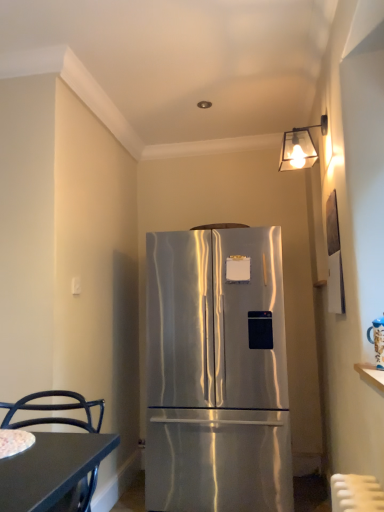
Describe the element at coordinates (300, 147) in the screenshot. Image resolution: width=384 pixels, height=512 pixels. I see `metallic glass lampshade at upper right` at that location.

Identify the location of black metal chair at lower left. Image resolution: width=384 pixels, height=512 pixels. (53, 409).

Do you think stainless steel refrigerator at center is within black metal chair at lower left, or outside of it?

stainless steel refrigerator at center is located beyond the bounds of black metal chair at lower left.

From a real-world perspective, which object stands above the other?

In real-world perspective, stainless steel refrigerator at center is above.

This screenshot has width=384, height=512. In order to click on refrigerator that is above the black metal chair at lower left (from a real-world perspective) in this screenshot , I will do [217, 372].

Does metallic glass lampshade at upper right contain stainless steel refrigerator at center?

No, stainless steel refrigerator at center is not inside metallic glass lampshade at upper right.

Is point (296, 157) positioned in front of point (222, 384)?

Yes, it is.

Is metallic glass lampshade at upper right to the right of stainless steel refrigerator at center from the viewer's perspective?

Yes, metallic glass lampshade at upper right is to the right of stainless steel refrigerator at center.

Does metallic glass lampshade at upper right come behind stainless steel refrigerator at center?

No, it is in front of stainless steel refrigerator at center.

Where is `refrigerator that appears below the metallic glass lampshade at upper right (from a real-world perspective)`? refrigerator that appears below the metallic glass lampshade at upper right (from a real-world perspective) is located at coordinates coord(217,372).

Is stainless steel refrigerator at center closer to the viewer compared to metallic glass lampshade at upper right?

No, stainless steel refrigerator at center is behind metallic glass lampshade at upper right.

From the image's perspective, which is below, stainless steel refrigerator at center or metallic glass lampshade at upper right?

stainless steel refrigerator at center appears lower in the image.

Is there a large distance between stainless steel refrigerator at center and metallic glass lampshade at upper right?

Yes.

Is metallic glass lampshade at upper right at the right side of black metal chair at lower left?

Correct, you'll find metallic glass lampshade at upper right to the right of black metal chair at lower left.

Locate an element on the screen. The width and height of the screenshot is (384, 512). lamp behind the black metal chair at lower left is located at coordinates (300, 147).

Considering the sizes of objects metallic glass lampshade at upper right and black metal chair at lower left in the image provided, who is wider, metallic glass lampshade at upper right or black metal chair at lower left?

black metal chair at lower left.

Which object is closer to the camera, metallic glass lampshade at upper right or black metal chair at lower left?

black metal chair at lower left is in front.

Which is behind, black metal chair at lower left or metallic glass lampshade at upper right?

Positioned behind is metallic glass lampshade at upper right.

Is black metal chair at lower left spatially inside metallic glass lampshade at upper right, or outside of it?

black metal chair at lower left is not inside metallic glass lampshade at upper right, it's outside.

This screenshot has height=512, width=384. I want to click on chair in front of the metallic glass lampshade at upper right, so click(53, 409).

Considering the sizes of objects black metal chair at lower left and metallic glass lampshade at upper right in the image provided, who is wider, black metal chair at lower left or metallic glass lampshade at upper right?

With larger width is black metal chair at lower left.

Is black metal chair at lower left looking in the opposite direction of stainless steel refrigerator at center?

Correct, black metal chair at lower left is looking away from stainless steel refrigerator at center.

From the image's perspective, relative to stainless steel refrigerator at center, is black metal chair at lower left above or below?

black metal chair at lower left is situated higher than stainless steel refrigerator at center in the image.

From a real-world perspective, is black metal chair at lower left above or below stainless steel refrigerator at center?

black metal chair at lower left is situated lower than stainless steel refrigerator at center in the real world.

Does black metal chair at lower left have a lesser width compared to stainless steel refrigerator at center?

Yes.

I want to click on refrigerator behind the black metal chair at lower left, so click(217, 372).

You are a GUI agent. You are given a task and a screenshot of the screen. Output one action in this format:
    pyautogui.click(x=<x>, y=<y>)
    Task: Click on the refrigerator beneath the metallic glass lampshade at upper right (from a real-world perspective)
    This screenshot has height=512, width=384.
    Given the screenshot: What is the action you would take?
    pyautogui.click(x=217, y=372)

From the picture: Estimate the real-world distances between objects in this image. Which object is closer to black metal chair at lower left, metallic glass lampshade at upper right or stainless steel refrigerator at center?

Based on the image, stainless steel refrigerator at center appears to be nearer to black metal chair at lower left.

Based on their spatial positions, is stainless steel refrigerator at center or metallic glass lampshade at upper right further from black metal chair at lower left?

The object further to black metal chair at lower left is metallic glass lampshade at upper right.

From the image, which object appears to be farther from stainless steel refrigerator at center, metallic glass lampshade at upper right or black metal chair at lower left?

metallic glass lampshade at upper right is further to stainless steel refrigerator at center.

Looking at this image, based on their spatial positions, is black metal chair at lower left or metallic glass lampshade at upper right closer to stainless steel refrigerator at center?

Among the two, black metal chair at lower left is located nearer to stainless steel refrigerator at center.

Looking at the image, which one is located closer to metallic glass lampshade at upper right, black metal chair at lower left or stainless steel refrigerator at center?

stainless steel refrigerator at center.

Looking at the image, which one is located closer to metallic glass lampshade at upper right, stainless steel refrigerator at center or black metal chair at lower left?

stainless steel refrigerator at center is positioned closer to the anchor metallic glass lampshade at upper right.

At what (x,y) coordinates should I click in order to perform the action: click on chair that lies between metallic glass lampshade at upper right and stainless steel refrigerator at center from top to bottom. Please return your answer as a coordinate pair (x, y). The height and width of the screenshot is (512, 384). Looking at the image, I should click on pyautogui.click(x=53, y=409).